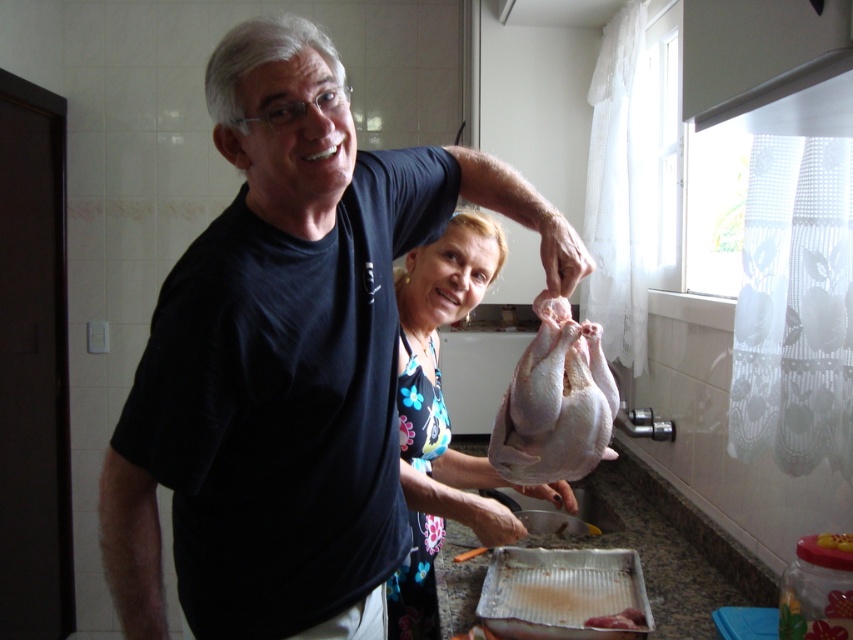
Question: Is black matte shirt at center to the right of pinkish raw meat at lower center from the viewer's perspective?

Choices:
 (A) no
 (B) yes

Answer: (A)

Question: Which point is closer to the camera?

Choices:
 (A) black matte shirt at center
 (B) pinkish raw meat at lower center

Answer: (A)

Question: Which of the following is the farthest from the observer?

Choices:
 (A) pyautogui.click(x=183, y=595)
 (B) pyautogui.click(x=622, y=620)
 (C) pyautogui.click(x=564, y=417)

Answer: (B)

Question: Which point is farther to the camera?

Choices:
 (A) white floral dress at center
 (B) black matte shirt at center

Answer: (A)

Question: Can you confirm if white floral dress at center is wider than pinkish raw meat at lower center?

Choices:
 (A) yes
 (B) no

Answer: (A)

Question: Is white raw chicken at center further to the viewer compared to pinkish raw meat at lower center?

Choices:
 (A) no
 (B) yes

Answer: (A)